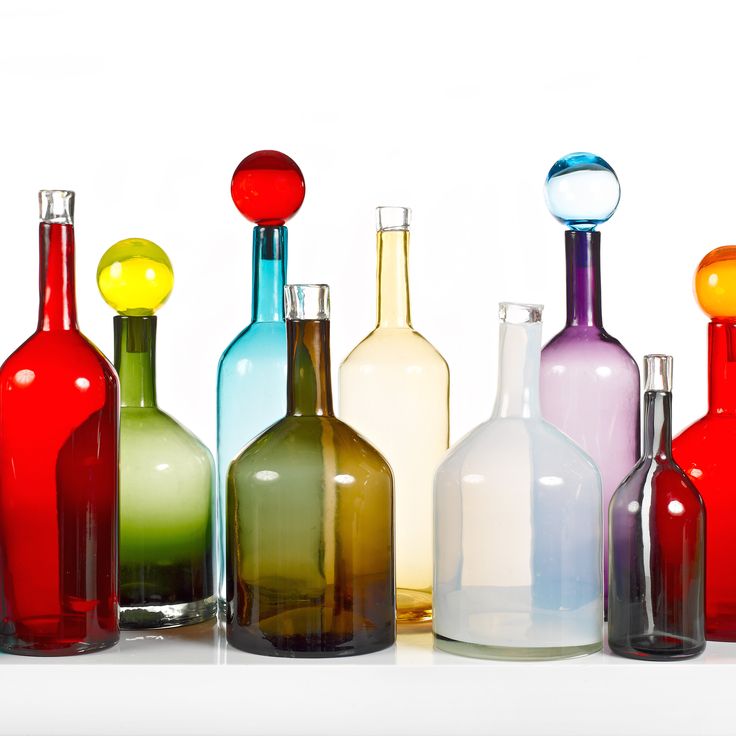
You are a GUI agent. You are given a task and a screenshot of the screen. Output one action in this format:
    pyautogui.click(x=<x>, y=<y>)
    Task: Click on the bottles
    
    Given the screenshot: What is the action you would take?
    pyautogui.click(x=46, y=447), pyautogui.click(x=173, y=526), pyautogui.click(x=230, y=403), pyautogui.click(x=285, y=541), pyautogui.click(x=394, y=406), pyautogui.click(x=528, y=541), pyautogui.click(x=584, y=389), pyautogui.click(x=667, y=534), pyautogui.click(x=718, y=450)